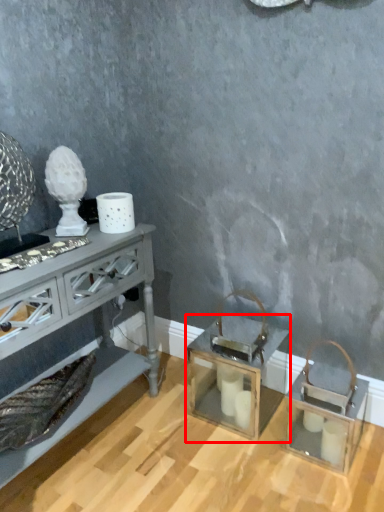
Question: From the image's perspective, where is table (annotated by the red box) located in relation to table in the image?

Choices:
 (A) above
 (B) below

Answer: (B)